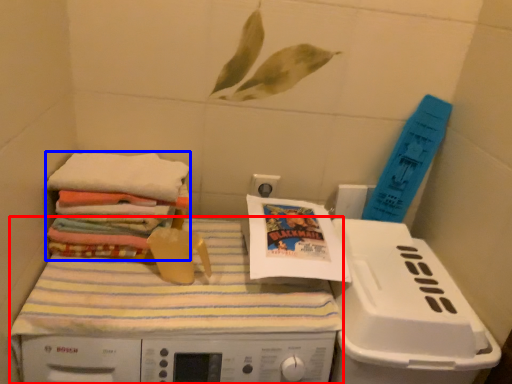
Question: Among these objects, which one is farthest to the camera, machine (highlighted by a red box) or material (highlighted by a blue box)?

Choices:
 (A) machine
 (B) material

Answer: (B)